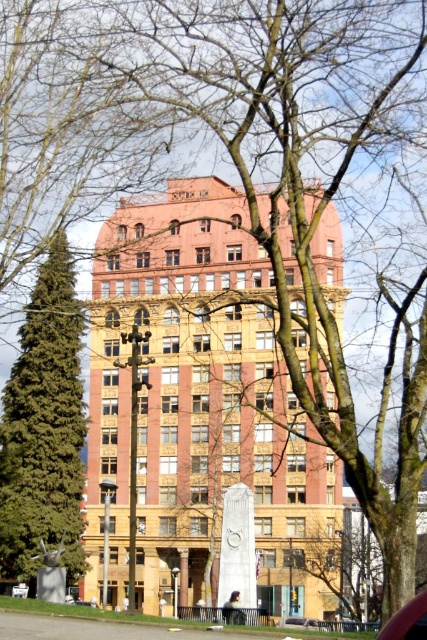
Can you confirm if green textured pine tree at left is wider than metallic red car at lower right?

Correct, the width of green textured pine tree at left exceeds that of metallic red car at lower right.

Is green textured pine tree at left further to the viewer compared to metallic red car at lower right?

Yes, it is behind metallic red car at lower right.

Does point (14, 369) come in front of point (424, 628)?

No, (14, 369) is behind (424, 628).

At what (x,y) coordinates should I click in order to perform the action: click on green textured pine tree at left. Please return your answer as a coordinate pair (x, y). This screenshot has width=427, height=640. Looking at the image, I should click on (44, 426).

Is point (414, 609) farther from viewer compared to point (292, 625)?

No, it is in front of (292, 625).

Can you confirm if metallic red car at lower right is bigger than metallic silver car at center?

Correct, metallic red car at lower right is larger in size than metallic silver car at center.

The height and width of the screenshot is (640, 427). What do you see at coordinates (408, 620) in the screenshot?
I see `metallic red car at lower right` at bounding box center [408, 620].

This screenshot has height=640, width=427. I want to click on metallic red car at lower right, so click(408, 620).

Does bare branches at center have a greater height compared to metallic silver car at center?

Yes, bare branches at center is taller than metallic silver car at center.

Who is more forward, (368,612) or (292,627)?

Point (292,627) is in front.

Where is `bare branches at center`? bare branches at center is located at coordinates (345, 566).